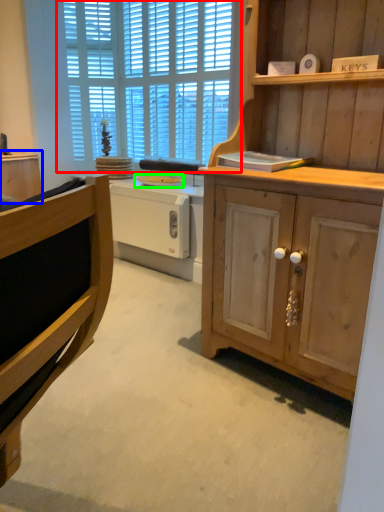
Question: Which object is positioned closest to window (highlighted by a red box)? Select from cabinetry (highlighted by a blue box) and appliance (highlighted by a green box).

Choices:
 (A) cabinetry
 (B) appliance

Answer: (B)